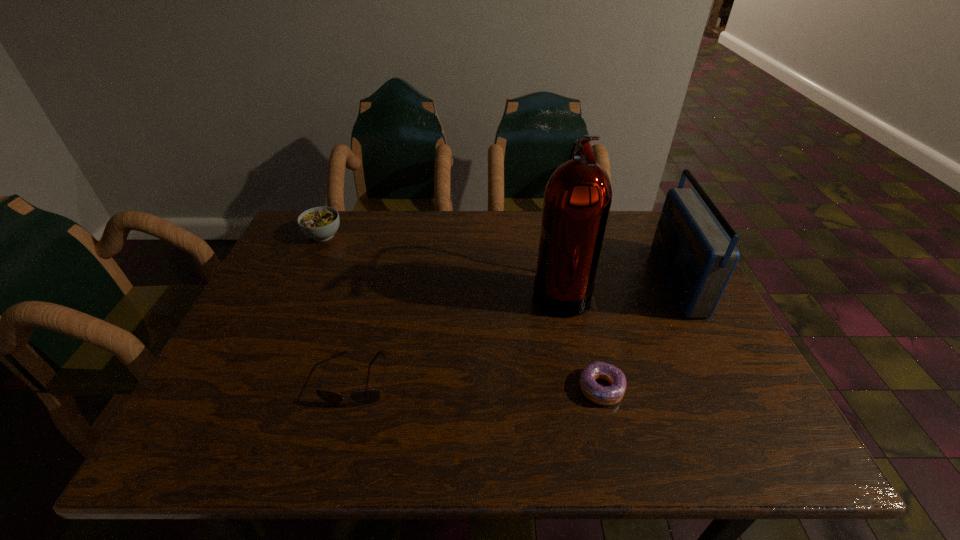
Find the location of a particular element. This screenshot has height=540, width=960. vacant region located 0.290m on the front-facing side of the fire extinguisher is located at coordinates (420, 290).

What are the coordinates of `vacant area located 0.240m on the front panel of the rightmost object` in the screenshot? It's located at (x=569, y=281).

Image resolution: width=960 pixels, height=540 pixels. Find the location of `free space located on the front panel of the rightmost object`. free space located on the front panel of the rightmost object is located at coordinates (641, 281).

Identify the location of vacant space situated 0.180m on the front panel of the rightmost object. (592, 281).

The width and height of the screenshot is (960, 540). Identify the location of free space located on the right of the leftmost object. (412, 235).

Where is `free location located on the front-facing side of the sunglasses`? This screenshot has height=540, width=960. free location located on the front-facing side of the sunglasses is located at coordinates (344, 431).

The height and width of the screenshot is (540, 960). What are the coordinates of `vacant space located 0.110m on the right of the doughnut` in the screenshot? It's located at (677, 388).

Find the location of `radio receiver that is at the far edge`. radio receiver that is at the far edge is located at coordinates (697, 258).

You are a GUI agent. You are given a task and a screenshot of the screen. Output one action in this format:
    pyautogui.click(x=<x>, y=<y>)
    Task: Click on the soup bowl at the far edge
    This screenshot has width=960, height=540.
    Given the screenshot: What is the action you would take?
    pyautogui.click(x=319, y=223)

Image resolution: width=960 pixels, height=540 pixels. I want to click on object present at the left edge, so click(319, 223).